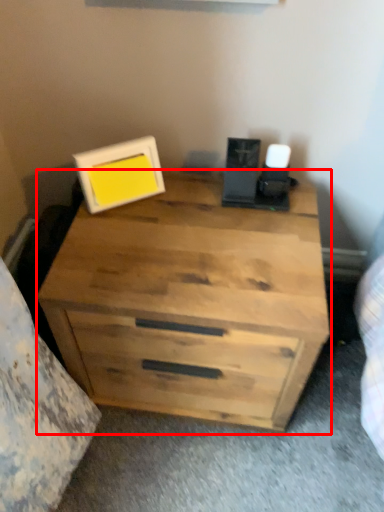
Question: Observing the image, what is the correct spatial positioning of chest of drawers (annotated by the red box) in reference to picture frame?

Choices:
 (A) left
 (B) right

Answer: (B)